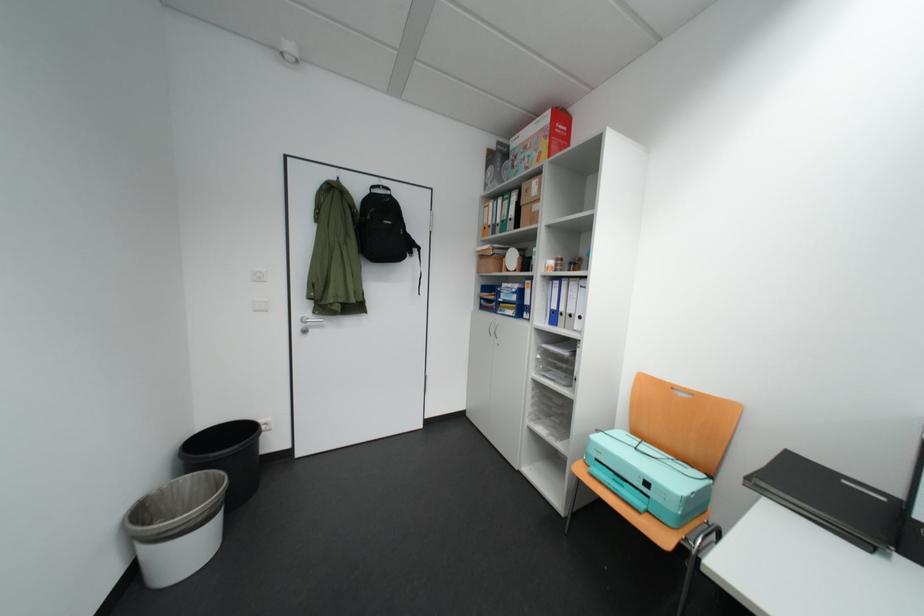
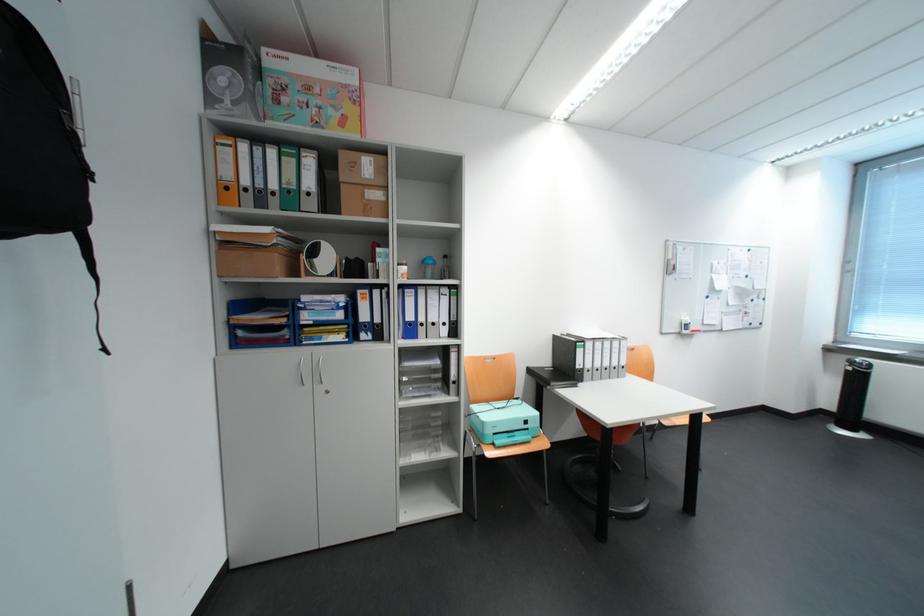
Find the pixel in the second image that matches (519,148) in the first image.

(272, 60)